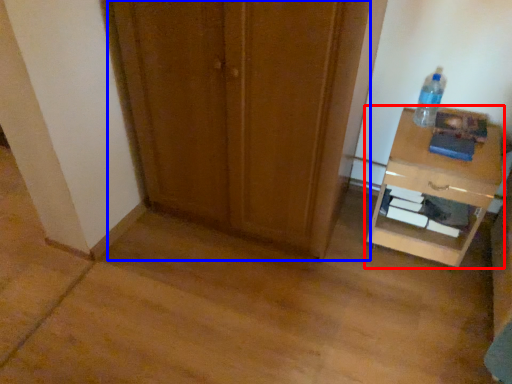
Question: Which of the following is the closest to the observer, nightstand (highlighted by a red box) or door (highlighted by a blue box)?

Choices:
 (A) nightstand
 (B) door

Answer: (B)